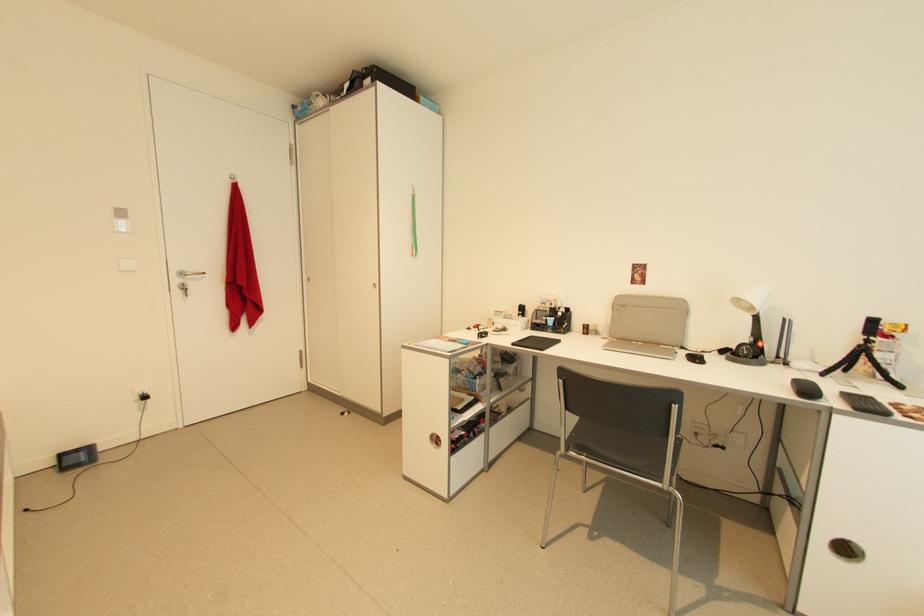
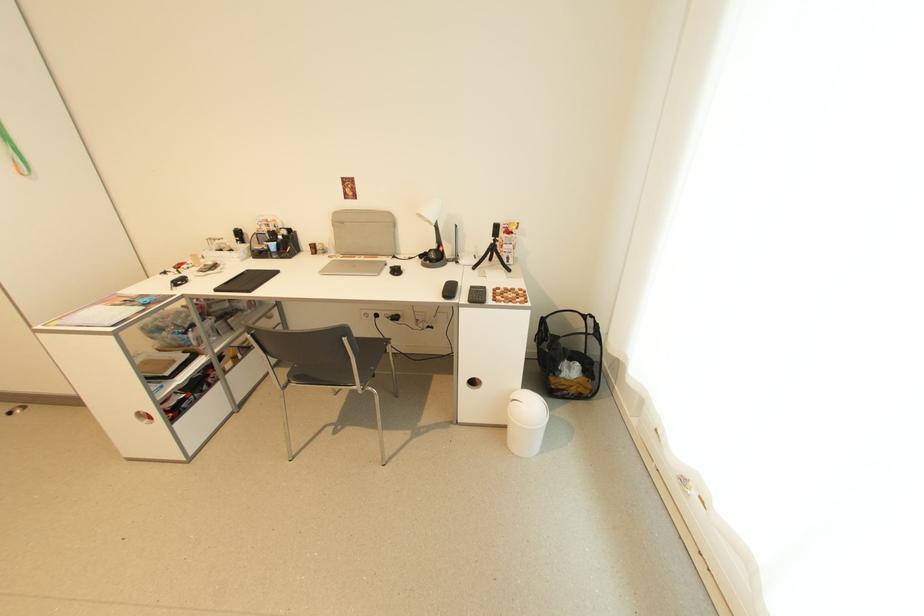
Find the pixel in the second image that matches the point at 869,337 in the first image.

(497, 238)